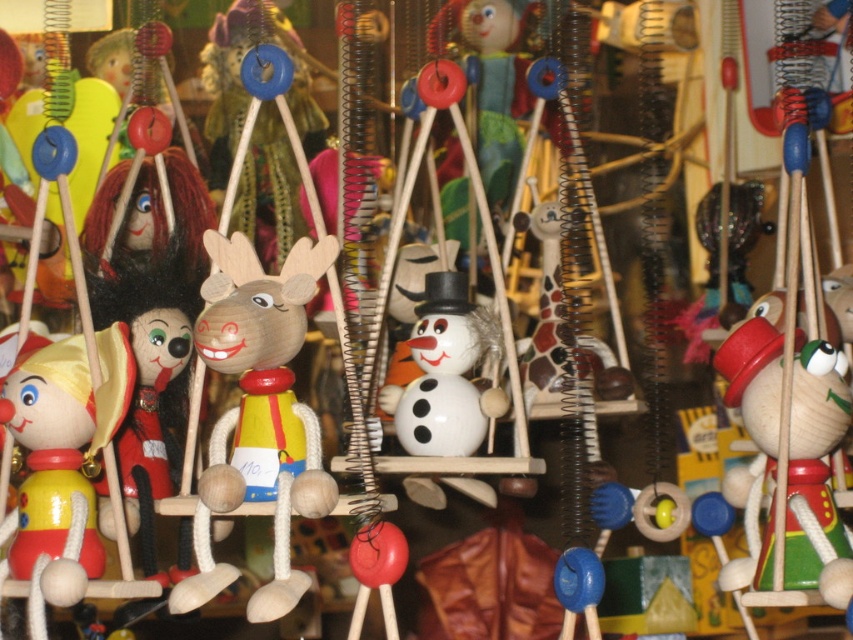
Question: Among these objects, which one is nearest to the camera?

Choices:
 (A) wooden clown at center
 (B) wooden reindeer at center

Answer: (A)

Question: In this image, where is wooden clown at center located relative to matte yellow wood clown at left?

Choices:
 (A) above
 (B) below

Answer: (A)

Question: Which point is closer to the camera?

Choices:
 (A) (757, 380)
 (B) (10, 387)

Answer: (A)

Question: Observing the image, what is the correct spatial positioning of wooden reindeer at center in reference to matte yellow wood clown at left?

Choices:
 (A) above
 (B) below

Answer: (A)

Question: Does wooden reindeer at center have a smaller size compared to wooden clown at center?

Choices:
 (A) yes
 (B) no

Answer: (B)

Question: Which of these objects is positioned closest to the matte yellow wood clown at left?

Choices:
 (A) wooden clown at center
 (B) wooden reindeer at center

Answer: (B)